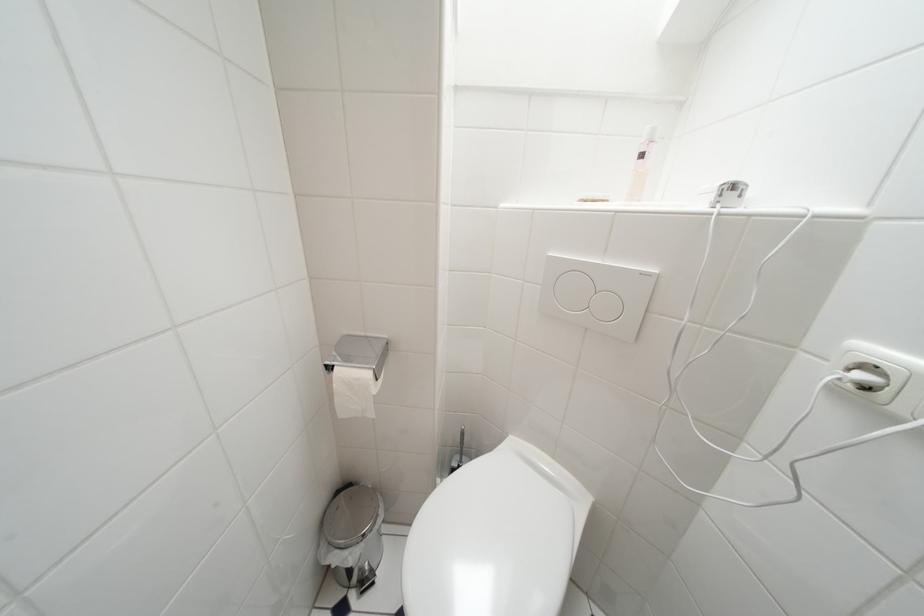
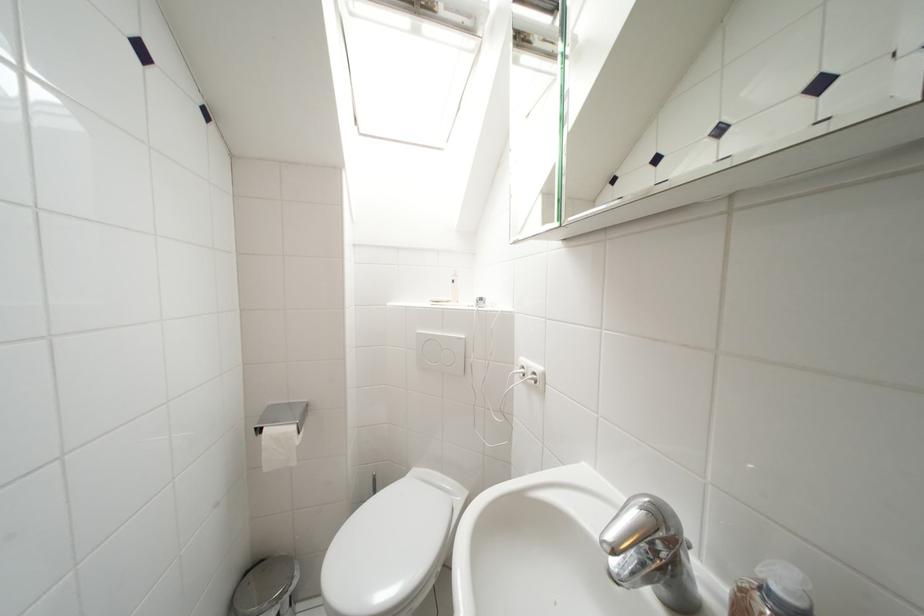
The point at (344, 495) is marked in the first image. Where is the corresponding point in the second image?

(253, 577)